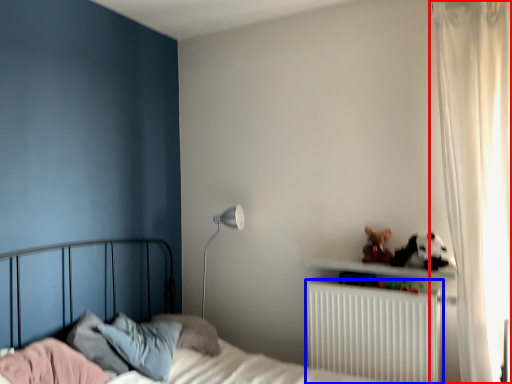
Question: Which object is closer to the camera taking this photo, curtain (highlighted by a red box) or radiator (highlighted by a blue box)?

Choices:
 (A) curtain
 (B) radiator

Answer: (A)